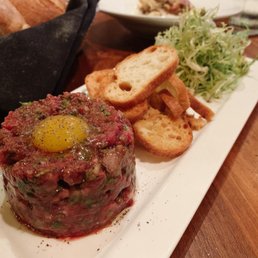
Identify the location of wood grain tabletop. (39, 7), (103, 51), (235, 223).